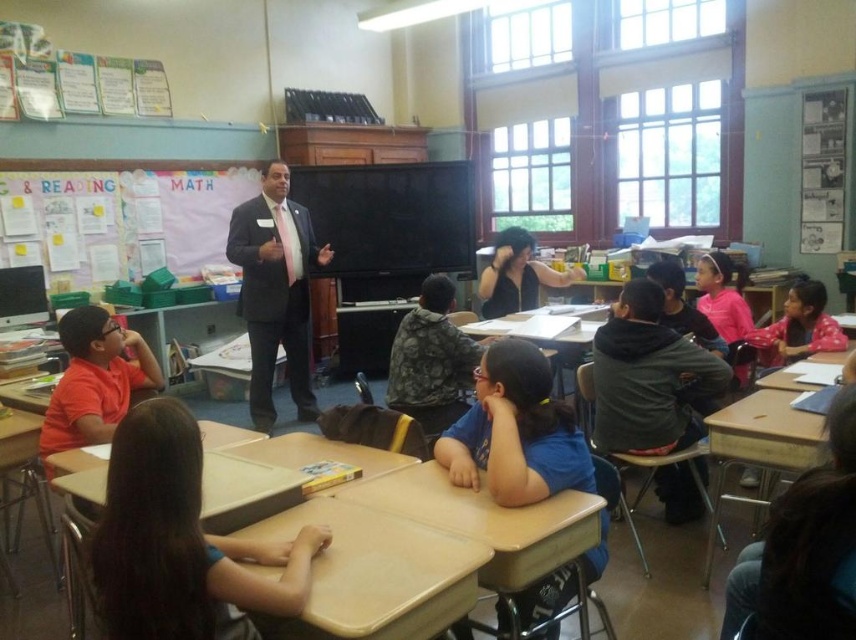
Question: Which of the following is the closest to the observer?

Choices:
 (A) light brown wood desk at lower left
 (B) blue cotton shirt at lower left
 (C) tan matte table at center
 (D) blue matte shirt at center

Answer: (B)

Question: Does light brown wood desk at center appear on the right side of dark suit at center?

Choices:
 (A) no
 (B) yes

Answer: (B)

Question: Observing the image, what is the correct spatial positioning of blue cotton shirt at lower left in reference to pink cotton shirt at right?

Choices:
 (A) right
 (B) left

Answer: (B)

Question: Which object is the closest to the blue matte shirt at center?

Choices:
 (A) dark suit at center
 (B) light brown wood desk at lower right

Answer: (B)

Question: Which is farther from the dark suit at center?

Choices:
 (A) blue matte shirt at center
 (B) light brown wood desk at lower right
 (C) blue cotton shirt at lower left

Answer: (C)

Question: Is dark suit at center thinner than light brown wood desk at lower right?

Choices:
 (A) no
 (B) yes

Answer: (A)